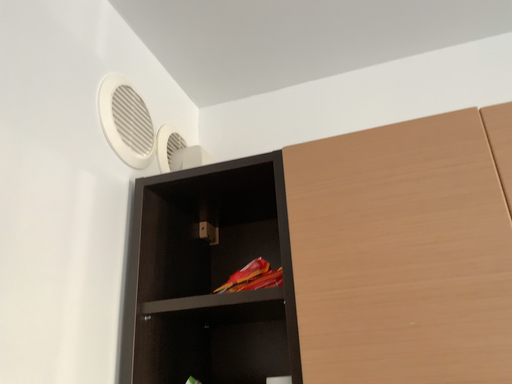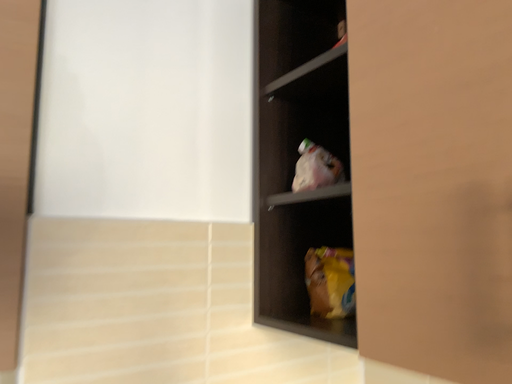
Question: Which way did the camera rotate in the video?

Choices:
 (A) rotated right
 (B) rotated left

Answer: (B)